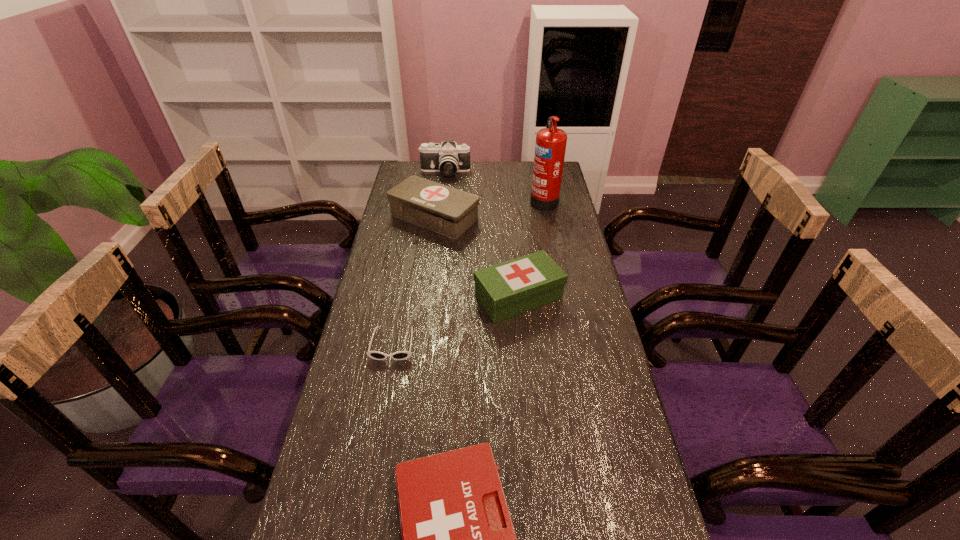
The width and height of the screenshot is (960, 540). I want to click on fire extinguisher, so click(x=550, y=146).

Identify the location of the farthest object. Image resolution: width=960 pixels, height=540 pixels. (448, 158).

Find the location of a particular element. Image resolution: width=960 pixels, height=540 pixels. the fifth shortest object is located at coordinates (448, 158).

This screenshot has width=960, height=540. What are the coordinates of `the farthest first-aid kit` in the screenshot? It's located at (451, 212).

Where is `the second farthest first-aid kit`? The image size is (960, 540). the second farthest first-aid kit is located at coordinates (507, 289).

Image resolution: width=960 pixels, height=540 pixels. What are the coordinates of `sunglasses` in the screenshot? It's located at (400, 355).

Identify the location of the second nearest object. The height and width of the screenshot is (540, 960). (400, 355).

In order to click on vacant space located 0.080m on the surface of the fire extinguisher in this screenshot , I will do `click(511, 200)`.

Image resolution: width=960 pixels, height=540 pixels. In order to click on free space located on the surface of the fire extinguisher in this screenshot , I will do `click(474, 200)`.

Find the location of `vacant space located 0.170m on the surface of the fire extinguisher`. vacant space located 0.170m on the surface of the fire extinguisher is located at coordinates (489, 200).